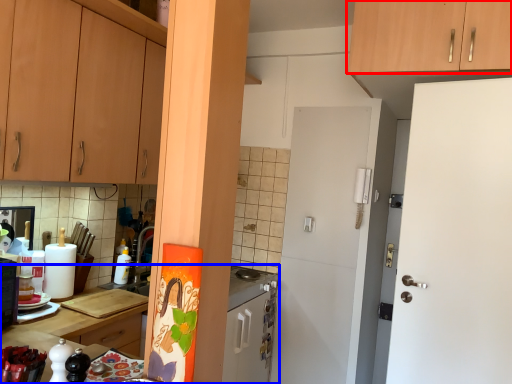
Question: Among these objects, which one is farthest to the camera, cabinetry (highlighted by a red box) or countertop (highlighted by a blue box)?

Choices:
 (A) cabinetry
 (B) countertop

Answer: (A)